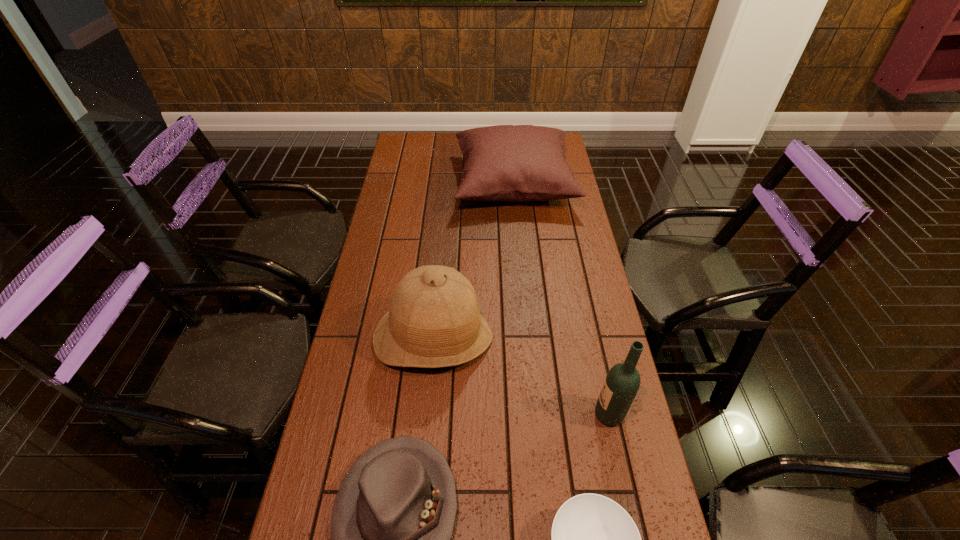
Identify the location of object positioned at the far edge. The image size is (960, 540). (517, 163).

In order to click on object positioned at the left edge in this screenshot , I will do `click(434, 320)`.

You are a GUI agent. You are given a task and a screenshot of the screen. Output one action in this format:
    pyautogui.click(x=<x>, y=<y>)
    Task: Click on the wine bottle that is at the right edge
    This screenshot has height=540, width=960.
    Given the screenshot: What is the action you would take?
    pyautogui.click(x=622, y=382)

At what (x,y) coordinates should I click in order to perform the action: click on cushion located in the right edge section of the desktop. Please return your answer as a coordinate pair (x, y). Looking at the image, I should click on (517, 163).

Identify the location of object that is at the far right corner. (517, 163).

The image size is (960, 540). In the image, there is a desktop. Identify the location of vacant space at the far edge. pyautogui.click(x=447, y=139).

In the image, there is a desktop. Where is `blank space at the left edge`? This screenshot has width=960, height=540. blank space at the left edge is located at coordinates (388, 299).

You are a GUI agent. You are given a task and a screenshot of the screen. Output one action in this format:
    pyautogui.click(x=<x>, y=<y>)
    Task: Click on the free space at the right edge of the desktop
    This screenshot has height=540, width=960.
    Given the screenshot: What is the action you would take?
    pyautogui.click(x=558, y=293)

At what (x,y) coordinates should I click in order to perform the action: click on vacant region between the third nearest object and the third tallest object. Please return your answer as a coordinate pair (x, y). The image size is (960, 540). Looking at the image, I should click on (562, 299).

Locate an element on the screen. The width and height of the screenshot is (960, 540). empty location between the wine bottle and the taller hat is located at coordinates (521, 376).